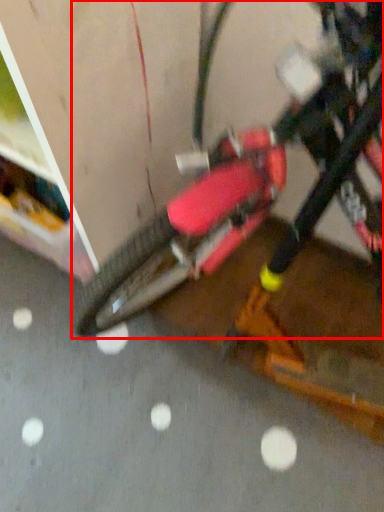
Question: In this image, where is bicycle (annotated by the red box) located relative to concrete?

Choices:
 (A) left
 (B) right

Answer: (B)